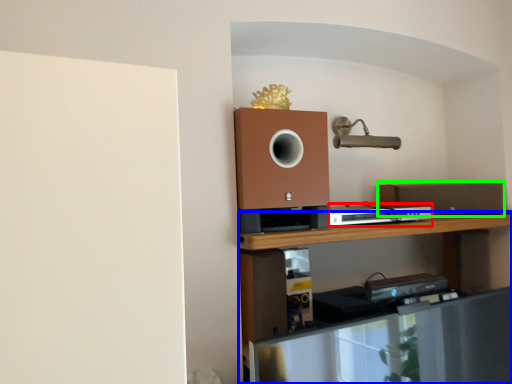
Question: Based on their relative distances, which object is farther from appliance (highlighted by a red box)? Choose from shelf (highlighted by a blue box) and speaker (highlighted by a green box).

Choices:
 (A) shelf
 (B) speaker

Answer: (B)